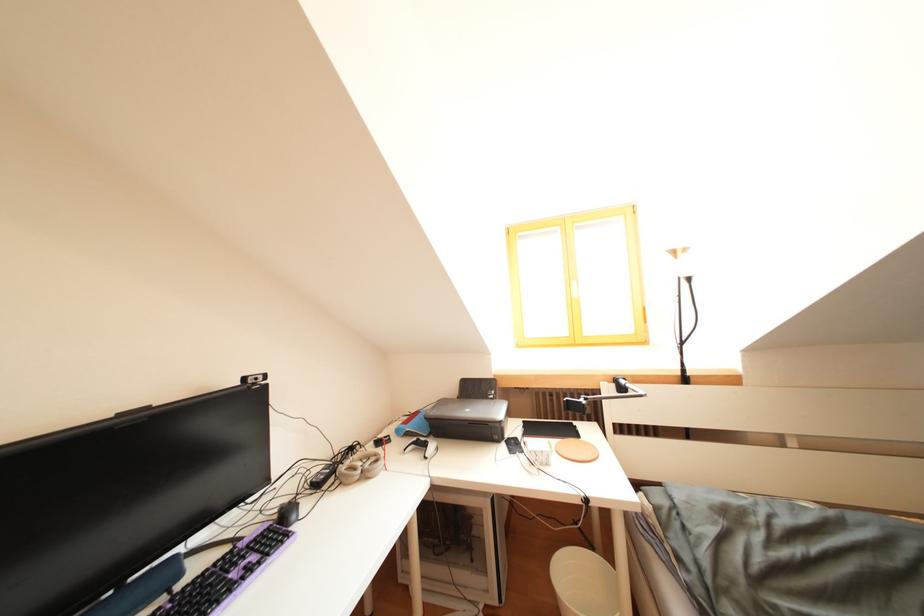
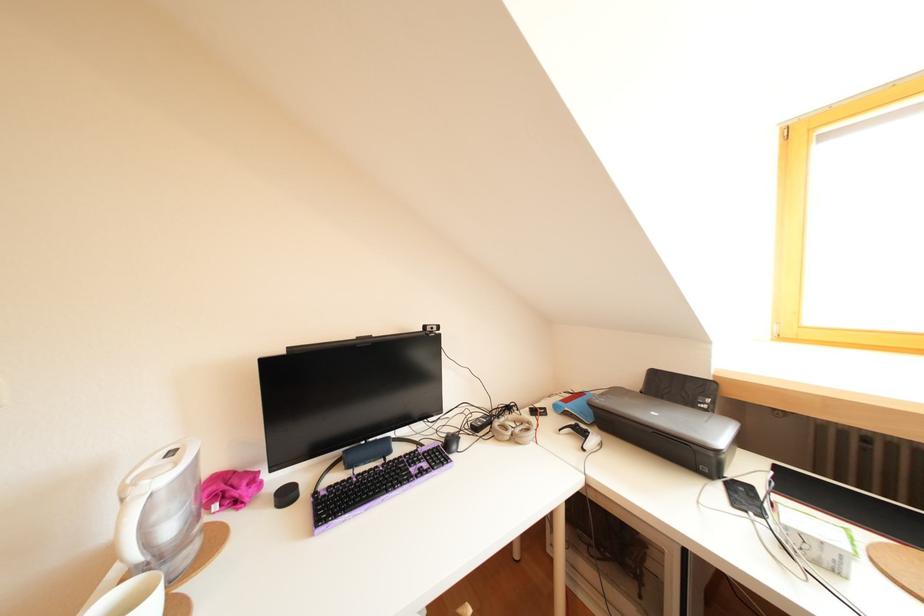
Find the pixel in the second image that matches point 512,450 in the first image.

(727, 490)